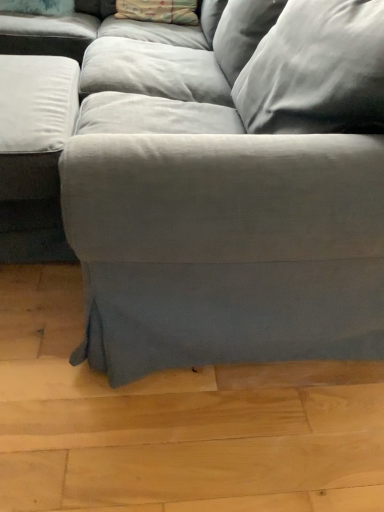
Image resolution: width=384 pixels, height=512 pixels. Describe the element at coordinates (159, 11) in the screenshot. I see `patterned fabric pillow at upper center, the second pillow from the left` at that location.

The image size is (384, 512). Identify the location of patterned fabric pillow at upper center, the second pillow from the left. (159, 11).

How much space does fluffy white pillow at upper left, which ranks as the 2th pillow in right-to-left order, occupy horizontally?

fluffy white pillow at upper left, which ranks as the 2th pillow in right-to-left order, is 24.35 centimeters in width.

What do you see at coordinates (38, 7) in the screenshot? This screenshot has width=384, height=512. I see `fluffy white pillow at upper left, which ranks as the 2th pillow in right-to-left order` at bounding box center [38, 7].

Locate an element on the screen. fluffy white pillow at upper left, which ranks as the 2th pillow in right-to-left order is located at coordinates (38, 7).

Locate an element on the screen. patterned fabric pillow at upper center, the second pillow from the left is located at coordinates (159, 11).

Is fluffy white pillow at upper left, which ranks as the 2th pillow in right-to-left order, at the right side of patterned fabric pillow at upper center, which appears as the first pillow when viewed from the right?

Incorrect, fluffy white pillow at upper left, which ranks as the 2th pillow in right-to-left order, is not on the right side of patterned fabric pillow at upper center, which appears as the first pillow when viewed from the right.

Is fluffy white pillow at upper left, the 1th pillow positioned from the left, closer to camera compared to patterned fabric pillow at upper center, which appears as the first pillow when viewed from the right?

Yes, it is.

Does point (58, 15) lie in front of point (136, 16)?

No.

From the image's perspective, which is above, fluffy white pillow at upper left, which ranks as the 2th pillow in right-to-left order, or patterned fabric pillow at upper center, which appears as the first pillow when viewed from the right?

patterned fabric pillow at upper center, which appears as the first pillow when viewed from the right, from the image's perspective.

From a real-world perspective, who is located lower, fluffy white pillow at upper left, which ranks as the 2th pillow in right-to-left order, or patterned fabric pillow at upper center, the second pillow from the left?

From a 3D spatial view, fluffy white pillow at upper left, which ranks as the 2th pillow in right-to-left order, is below.

Which of these two, fluffy white pillow at upper left, which ranks as the 2th pillow in right-to-left order, or patterned fabric pillow at upper center, which appears as the first pillow when viewed from the right, is wider?

patterned fabric pillow at upper center, which appears as the first pillow when viewed from the right.

Based on the photo, is fluffy white pillow at upper left, which ranks as the 2th pillow in right-to-left order, taller than patterned fabric pillow at upper center, which appears as the first pillow when viewed from the right?

Incorrect, the height of fluffy white pillow at upper left, which ranks as the 2th pillow in right-to-left order, is not larger of that of patterned fabric pillow at upper center, which appears as the first pillow when viewed from the right.

Which of these two, fluffy white pillow at upper left, the 1th pillow positioned from the left, or patterned fabric pillow at upper center, which appears as the first pillow when viewed from the right, is bigger?

With larger size is patterned fabric pillow at upper center, which appears as the first pillow when viewed from the right.

Would you say patterned fabric pillow at upper center, the second pillow from the left, is part of fluffy white pillow at upper left, which ranks as the 2th pillow in right-to-left order,'s contents?

That's incorrect, patterned fabric pillow at upper center, the second pillow from the left, is not inside fluffy white pillow at upper left, which ranks as the 2th pillow in right-to-left order.

Is fluffy white pillow at upper left, which ranks as the 2th pillow in right-to-left order, far from patterned fabric pillow at upper center, which appears as the first pillow when viewed from the right?

No, there isn't a large distance between fluffy white pillow at upper left, which ranks as the 2th pillow in right-to-left order, and patterned fabric pillow at upper center, which appears as the first pillow when viewed from the right.

Could you tell me if fluffy white pillow at upper left, the 1th pillow positioned from the left, is turned towards patterned fabric pillow at upper center, which appears as the first pillow when viewed from the right?

No, fluffy white pillow at upper left, the 1th pillow positioned from the left, is not oriented towards patterned fabric pillow at upper center, which appears as the first pillow when viewed from the right.

This screenshot has height=512, width=384. I want to click on pillow behind the fluffy white pillow at upper left, the 1th pillow positioned from the left, so click(x=159, y=11).

Visually, is patterned fabric pillow at upper center, the second pillow from the left, positioned to the left or to the right of fluffy white pillow at upper left, which ranks as the 2th pillow in right-to-left order?

In the image, patterned fabric pillow at upper center, the second pillow from the left, appears on the right side of fluffy white pillow at upper left, which ranks as the 2th pillow in right-to-left order.

Is patterned fabric pillow at upper center, which appears as the first pillow when viewed from the right, behind fluffy white pillow at upper left, the 1th pillow positioned from the left?

Yes, it is.

Which is behind, point (169, 18) or point (70, 12)?

The point (70, 12) is behind.

From the image's perspective, relative to fluffy white pillow at upper left, which ranks as the 2th pillow in right-to-left order, is patterned fabric pillow at upper center, the second pillow from the left, above or below?

From the image's perspective, patterned fabric pillow at upper center, the second pillow from the left, appears above fluffy white pillow at upper left, which ranks as the 2th pillow in right-to-left order.

From a real-world perspective, which object stands above the other?

patterned fabric pillow at upper center, the second pillow from the left.

Considering the sizes of objects patterned fabric pillow at upper center, which appears as the first pillow when viewed from the right, and fluffy white pillow at upper left, the 1th pillow positioned from the left, in the image provided, who is thinner, patterned fabric pillow at upper center, which appears as the first pillow when viewed from the right, or fluffy white pillow at upper left, the 1th pillow positioned from the left,?

Thinner between the two is fluffy white pillow at upper left, the 1th pillow positioned from the left.

Does patterned fabric pillow at upper center, which appears as the first pillow when viewed from the right, have a greater height compared to fluffy white pillow at upper left, which ranks as the 2th pillow in right-to-left order?

Indeed, patterned fabric pillow at upper center, which appears as the first pillow when viewed from the right, has a greater height compared to fluffy white pillow at upper left, which ranks as the 2th pillow in right-to-left order.

Does patterned fabric pillow at upper center, the second pillow from the left, have a smaller size compared to fluffy white pillow at upper left, the 1th pillow positioned from the left?

No, patterned fabric pillow at upper center, the second pillow from the left, is not smaller than fluffy white pillow at upper left, the 1th pillow positioned from the left.

Is patterned fabric pillow at upper center, which appears as the first pillow when viewed from the right, spatially inside fluffy white pillow at upper left, which ranks as the 2th pillow in right-to-left order, or outside of it?

patterned fabric pillow at upper center, which appears as the first pillow when viewed from the right, exists outside the volume of fluffy white pillow at upper left, which ranks as the 2th pillow in right-to-left order.

Is patterned fabric pillow at upper center, the second pillow from the left, far away from fluffy white pillow at upper left, the 1th pillow positioned from the left?

No.

Based on the photo, is patterned fabric pillow at upper center, the second pillow from the left, aimed at fluffy white pillow at upper left, the 1th pillow positioned from the left?

No, patterned fabric pillow at upper center, the second pillow from the left, is not turned towards fluffy white pillow at upper left, the 1th pillow positioned from the left.

Can you tell me how much patterned fabric pillow at upper center, the second pillow from the left, and fluffy white pillow at upper left, which ranks as the 2th pillow in right-to-left order, differ in facing direction?

The angle between the facing direction of patterned fabric pillow at upper center, the second pillow from the left, and the facing direction of fluffy white pillow at upper left, which ranks as the 2th pillow in right-to-left order, is 2.24 degrees.

I want to click on pillow on the right of fluffy white pillow at upper left, the 1th pillow positioned from the left, so click(159, 11).

Where is `pillow behind the fluffy white pillow at upper left, which ranks as the 2th pillow in right-to-left order`? pillow behind the fluffy white pillow at upper left, which ranks as the 2th pillow in right-to-left order is located at coordinates (159, 11).

At what (x,y) coordinates should I click in order to perform the action: click on pillow that appears below the patterned fabric pillow at upper center, the second pillow from the left (from the image's perspective). Please return your answer as a coordinate pair (x, y). The width and height of the screenshot is (384, 512). Looking at the image, I should click on (38, 7).